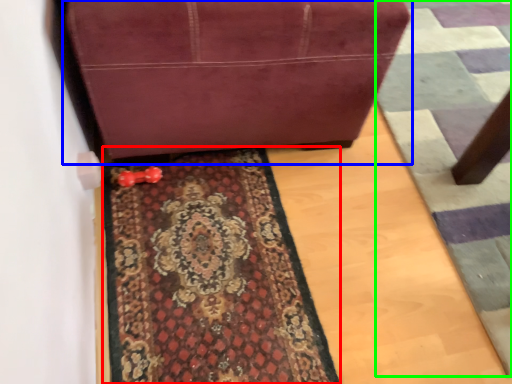
Question: Based on their relative distances, which object is nearer to mat (highlighted by a red box)? Choose from furniture (highlighted by a blue box) and doormat (highlighted by a green box).

Choices:
 (A) furniture
 (B) doormat

Answer: (A)